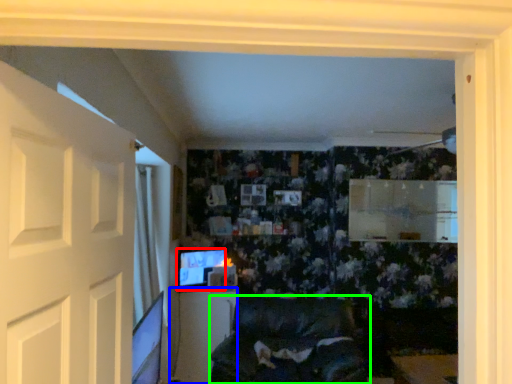
Question: Considering the real-world distances, which object is closest to computer monitor (highlighted by a red box)? table (highlighted by a blue box) or furniture (highlighted by a green box).

Choices:
 (A) table
 (B) furniture

Answer: (A)